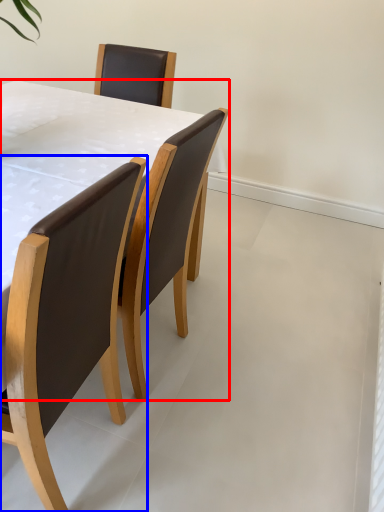
Question: Which object appears closest to the camera in this image, table (highlighted by a red box) or chair (highlighted by a blue box)?

Choices:
 (A) table
 (B) chair

Answer: (B)